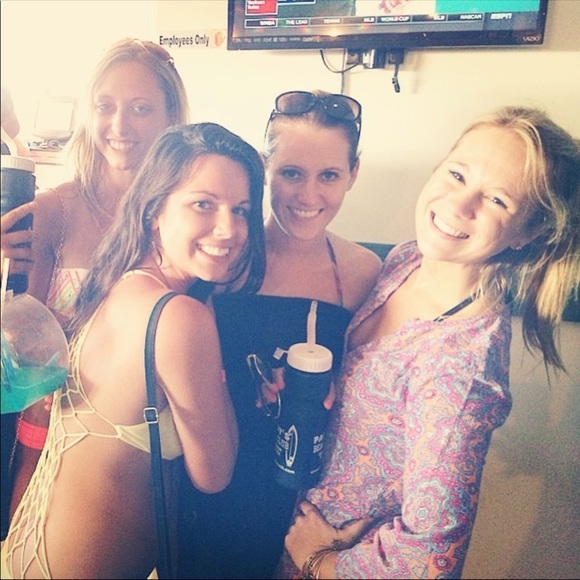
Image resolution: width=580 pixels, height=580 pixels. Find the location of `bottle`. bottle is located at coordinates (300, 394).